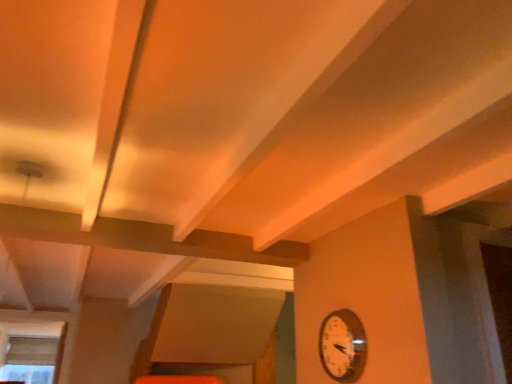
Question: From the image's perspective, does clear glass window at lower left appear higher than metallic silver clock at lower right?

Choices:
 (A) yes
 (B) no

Answer: (B)

Question: Can you confirm if clear glass window at lower left is smaller than metallic silver clock at lower right?

Choices:
 (A) yes
 (B) no

Answer: (B)

Question: Can you confirm if clear glass window at lower left is positioned to the left of metallic silver clock at lower right?

Choices:
 (A) no
 (B) yes

Answer: (B)

Question: Does clear glass window at lower left have a lesser height compared to metallic silver clock at lower right?

Choices:
 (A) no
 (B) yes

Answer: (A)

Question: Is clear glass window at lower left next to metallic silver clock at lower right?

Choices:
 (A) no
 (B) yes

Answer: (A)

Question: Can you confirm if clear glass window at lower left is bigger than metallic silver clock at lower right?

Choices:
 (A) yes
 (B) no

Answer: (A)

Question: Can you confirm if metallic silver clock at lower right is shorter than clear glass window at lower left?

Choices:
 (A) yes
 (B) no

Answer: (A)

Question: Could clear glass window at lower left be considered to be inside metallic silver clock at lower right?

Choices:
 (A) yes
 (B) no

Answer: (B)

Question: Is metallic silver clock at lower right bigger than clear glass window at lower left?

Choices:
 (A) yes
 (B) no

Answer: (B)

Question: Does metallic silver clock at lower right have a lesser width compared to clear glass window at lower left?

Choices:
 (A) no
 (B) yes

Answer: (B)

Question: Is metallic silver clock at lower right aimed at clear glass window at lower left?

Choices:
 (A) yes
 (B) no

Answer: (B)

Question: Considering the relative positions of metallic silver clock at lower right and clear glass window at lower left in the image provided, is metallic silver clock at lower right to the left of clear glass window at lower left from the viewer's perspective?

Choices:
 (A) yes
 (B) no

Answer: (B)

Question: From the image's perspective, relative to clear glass window at lower left, is metallic silver clock at lower right above or below?

Choices:
 (A) above
 (B) below

Answer: (A)